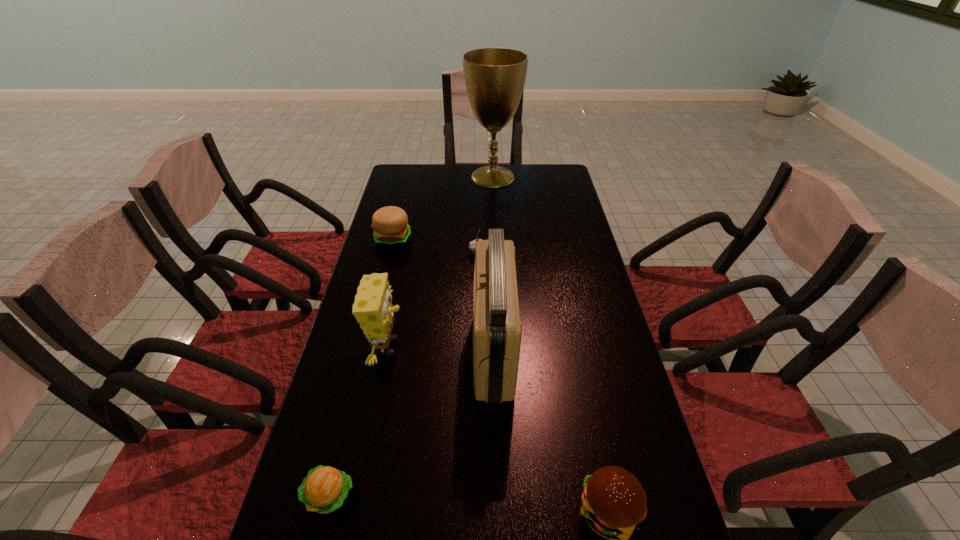
Image resolution: width=960 pixels, height=540 pixels. Identify the location of trophy cup. (494, 78).

Find the location of a particular element. The image size is (960, 540). the tallest object is located at coordinates (494, 78).

Locate an element on the screen. the sixth shortest object is located at coordinates (497, 330).

The width and height of the screenshot is (960, 540). Identify the location of sponge. (372, 308).

Where is `the farthest hamburger`? Image resolution: width=960 pixels, height=540 pixels. the farthest hamburger is located at coordinates (390, 224).

Identify the location of the second shortest object. The image size is (960, 540). (472, 245).

This screenshot has width=960, height=540. In order to click on the shortest hamburger in this screenshot , I will do `click(324, 489)`.

The image size is (960, 540). In order to click on free region located on the left of the tallest object in this screenshot , I will do 419,177.

In order to click on free location located 0.090m on the front-facing side of the radio receiver in this screenshot , I will do `click(440, 352)`.

Where is `vacant region located on the front-facing side of the radio receiver`? vacant region located on the front-facing side of the radio receiver is located at coordinates (444, 352).